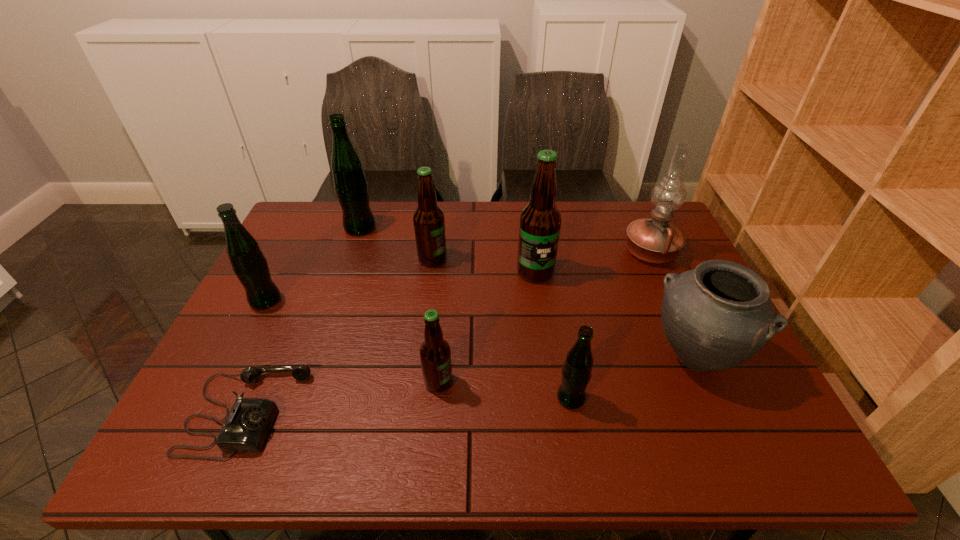
Locate an element on the screen. The image size is (960, 540). free space that is in between the farthest green beer bottle and the black urn is located at coordinates (527, 292).

In order to click on vacant space in between the oil lamp and the biggest brown beer bottle in this screenshot , I will do `click(593, 262)`.

Where is `free space between the oil lamp and the biggest brown beer bottle`? The width and height of the screenshot is (960, 540). free space between the oil lamp and the biggest brown beer bottle is located at coordinates (593, 262).

The height and width of the screenshot is (540, 960). What are the coordinates of `free space between the black urn and the shortest object` in the screenshot? It's located at click(470, 384).

This screenshot has width=960, height=540. Find the location of `vacant area between the farthest green beer bottle and the oil lamp`. vacant area between the farthest green beer bottle and the oil lamp is located at coordinates (505, 240).

Find the location of a particular element. This screenshot has height=540, width=960. free space that is in between the shortest object and the second biggest brown beer bottle is located at coordinates (340, 335).

I want to click on object that ranks as the seventh closest to the biggest brown beer bottle, so click(248, 423).

Choose which object is the second nearest neighbor to the leftmost beer bottle. Please provide its 2D coordinates. Your answer should be formatted as a tuple, i.e. [(x, y)], where the tuple contains the x and y coordinates of a point satisfying the conditions above.

[(350, 183)]

Locate an element on the screen. the closest beer bottle to the second biggest brown beer bottle is located at coordinates (350, 183).

Find the location of a particular element. The height and width of the screenshot is (540, 960). beer bottle that is the third closest to the urn is located at coordinates (435, 354).